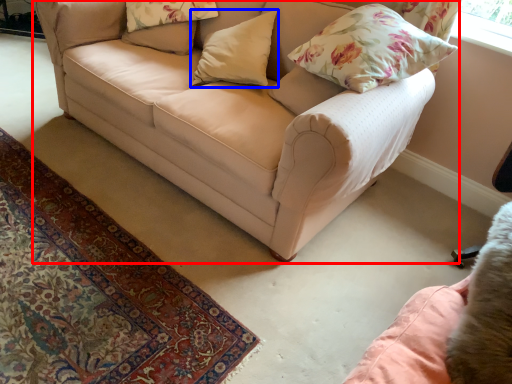
Question: Which object appears closest to the camera in this image, studio couch (highlighted by a red box) or pillow (highlighted by a blue box)?

Choices:
 (A) studio couch
 (B) pillow

Answer: (A)